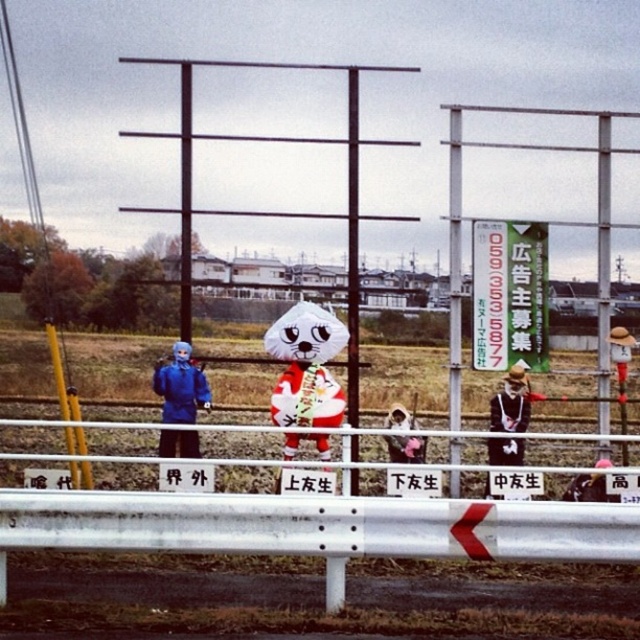
Question: Which of these objects is positioned closest to the matte black helmet at lower right?

Choices:
 (A) black leather jacket at center
 (B) white metal pole at center
 (C) white plush toy at center

Answer: (A)

Question: Is blue fabric person at left above light brown fabric bag at center?

Choices:
 (A) yes
 (B) no

Answer: (A)

Question: Which point appears farthest from the camera in this image?

Choices:
 (A) (456, 164)
 (B) (424, 588)

Answer: (A)

Question: Which point is closer to the camera?

Choices:
 (A) (179, 387)
 (B) (444, 586)
 (C) (515, 416)
 (D) (412, 438)

Answer: (B)

Question: Does white plush toy at center have a smaller size compared to light brown fabric bag at center?

Choices:
 (A) yes
 (B) no

Answer: (B)

Question: Does white metal pole at center have a larger size compared to black leather jacket at center?

Choices:
 (A) no
 (B) yes

Answer: (B)